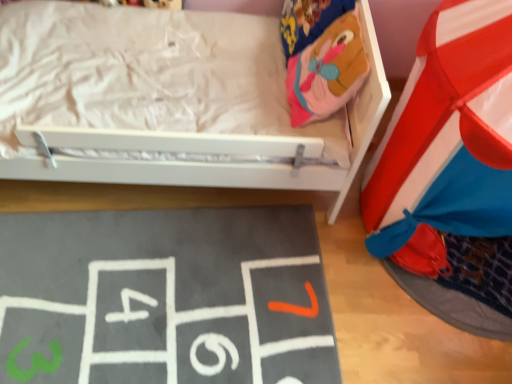
Question: From the image's perspective, is gray felt hopscotch at lower left below velvet pink plush bean bag at upper right?

Choices:
 (A) no
 (B) yes

Answer: (B)

Question: Considering the relative sizes of gray felt hopscotch at lower left and velvet pink plush bean bag at upper right in the image provided, is gray felt hopscotch at lower left taller than velvet pink plush bean bag at upper right?

Choices:
 (A) no
 (B) yes

Answer: (A)

Question: Does gray felt hopscotch at lower left have a larger size compared to velvet pink plush bean bag at upper right?

Choices:
 (A) no
 (B) yes

Answer: (A)

Question: From a real-world perspective, is gray felt hopscotch at lower left on velvet pink plush bean bag at upper right?

Choices:
 (A) yes
 (B) no

Answer: (B)

Question: Is gray felt hopscotch at lower left next to velvet pink plush bean bag at upper right?

Choices:
 (A) yes
 (B) no

Answer: (B)

Question: Is the depth of gray felt hopscotch at lower left greater than that of velvet pink plush bean bag at upper right?

Choices:
 (A) no
 (B) yes

Answer: (A)

Question: Can you confirm if velvet pink plush bean bag at upper right is shorter than gray felt hopscotch at lower left?

Choices:
 (A) no
 (B) yes

Answer: (A)

Question: Could you tell me if velvet pink plush bean bag at upper right is turned towards gray felt hopscotch at lower left?

Choices:
 (A) yes
 (B) no

Answer: (B)

Question: Are velvet pink plush bean bag at upper right and gray felt hopscotch at lower left beside each other?

Choices:
 (A) no
 (B) yes

Answer: (A)

Question: Is gray felt hopscotch at lower left surrounded by velvet pink plush bean bag at upper right?

Choices:
 (A) no
 (B) yes

Answer: (A)

Question: Does velvet pink plush bean bag at upper right come in front of gray felt hopscotch at lower left?

Choices:
 (A) no
 (B) yes

Answer: (A)

Question: From a real-world perspective, is velvet pink plush bean bag at upper right beneath gray felt hopscotch at lower left?

Choices:
 (A) yes
 (B) no

Answer: (B)

Question: In terms of width, does velvet pink plush bean bag at upper right look wider or thinner when compared to gray felt hopscotch at lower left?

Choices:
 (A) thin
 (B) wide

Answer: (A)